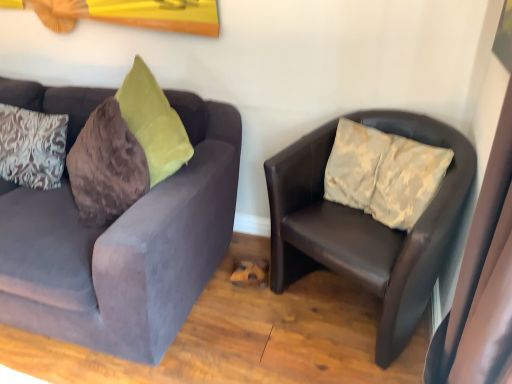
Question: Is velvet gray couch at left, the 2th studio couch viewed from the right, oriented away from white damask pillow at left?

Choices:
 (A) yes
 (B) no

Answer: (A)

Question: Is velvet gray couch at left, the 2th studio couch viewed from the right, thinner than white damask pillow at left?

Choices:
 (A) no
 (B) yes

Answer: (A)

Question: Is velvet gray couch at left, the 2th studio couch viewed from the right, closer to camera compared to white damask pillow at left?

Choices:
 (A) yes
 (B) no

Answer: (A)

Question: Could you tell me if velvet gray couch at left, the 2th studio couch viewed from the right, is facing white damask pillow at left?

Choices:
 (A) yes
 (B) no

Answer: (A)

Question: Does velvet gray couch at left, the 2th studio couch viewed from the right, have a greater height compared to white damask pillow at left?

Choices:
 (A) yes
 (B) no

Answer: (A)

Question: Considering the positions of leather chair at right, the 2th studio couch viewed from the left, and velvet gray couch at left, which ranks as the first studio couch in left-to-right order, in the image, is leather chair at right, the 2th studio couch viewed from the left, bigger or smaller than velvet gray couch at left, which ranks as the first studio couch in left-to-right order,?

Choices:
 (A) big
 (B) small

Answer: (B)

Question: Choose the correct answer: Is leather chair at right, the 2th studio couch viewed from the left, inside velvet gray couch at left, which ranks as the first studio couch in left-to-right order, or outside it?

Choices:
 (A) inside
 (B) outside

Answer: (B)

Question: Relative to velvet gray couch at left, the 2th studio couch viewed from the right, is leather chair at right, the 2th studio couch viewed from the left, in front or behind?

Choices:
 (A) behind
 (B) front

Answer: (A)

Question: Is point (279, 258) closer or farther from the camera than point (66, 190)?

Choices:
 (A) farther
 (B) closer

Answer: (B)

Question: Is white damask pillow at left taller or shorter than leather chair at right, the 2th studio couch viewed from the left?

Choices:
 (A) tall
 (B) short

Answer: (B)

Question: Is white damask pillow at left in front of or behind leather chair at right, the 2th studio couch viewed from the left, in the image?

Choices:
 (A) behind
 (B) front

Answer: (A)

Question: From the image's perspective, relative to leather chair at right, acting as the 1th studio couch starting from the right, is white damask pillow at left above or below?

Choices:
 (A) above
 (B) below

Answer: (A)

Question: Is point (22, 110) positioned closer to the camera than point (279, 201)?

Choices:
 (A) farther
 (B) closer

Answer: (A)

Question: Considering the positions of velvet gray couch at left, the 2th studio couch viewed from the right, and leather chair at right, the 2th studio couch viewed from the left, in the image, is velvet gray couch at left, the 2th studio couch viewed from the right, taller or shorter than leather chair at right, the 2th studio couch viewed from the left,?

Choices:
 (A) short
 (B) tall

Answer: (B)

Question: Considering the positions of point tap(41, 87) and point tap(349, 271), is point tap(41, 87) closer or farther from the camera than point tap(349, 271)?

Choices:
 (A) closer
 (B) farther

Answer: (B)